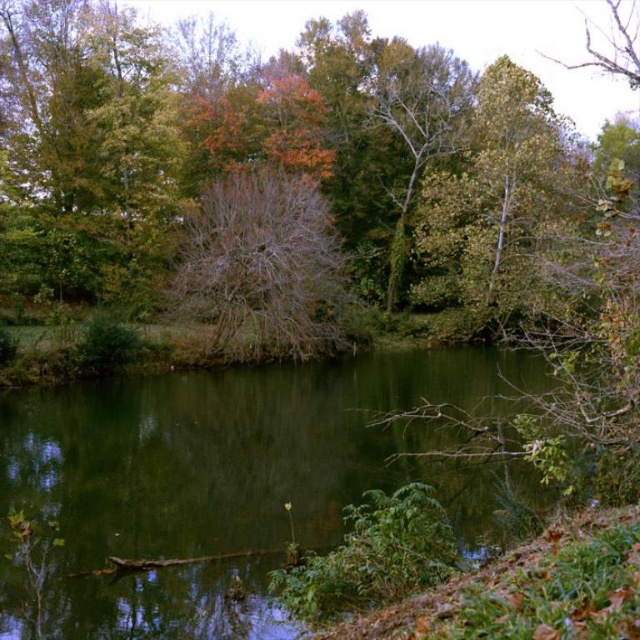
Question: Can you confirm if green liquid water at center is positioned to the left of bare branches at center?

Choices:
 (A) no
 (B) yes

Answer: (A)

Question: Observing the image, what is the correct spatial positioning of green liquid water at center in reference to bare branches at center?

Choices:
 (A) below
 (B) above

Answer: (A)

Question: Can you confirm if green liquid water at center is positioned below bare branches at center?

Choices:
 (A) no
 (B) yes

Answer: (B)

Question: Which object appears farthest from the camera in this image?

Choices:
 (A) bare branches at center
 (B) green liquid water at center

Answer: (A)

Question: Which point is closer to the camera?

Choices:
 (A) bare branches at center
 (B) green liquid water at center

Answer: (B)

Question: Which of the following is the farthest from the observer?

Choices:
 (A) (253, 627)
 (B) (211, 282)

Answer: (B)